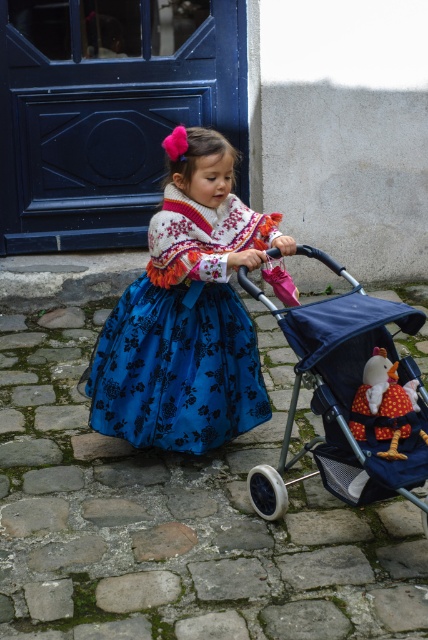
Is the position of matte blue stroller at center less distant than that of velvet plush doll at center?

Yes, it is.

Who is more distant from viewer, (410, 493) or (392, 451)?

The point (392, 451) is behind.

At what (x,y) coordinates should I click in order to perform the action: click on matte blue stroller at center. Please return your answer as a coordinate pair (x, y). Image resolution: width=428 pixels, height=640 pixels. Looking at the image, I should click on (332, 387).

Is blue satin dress at center to the left of velvet plush doll at center from the viewer's perspective?

Yes, blue satin dress at center is to the left of velvet plush doll at center.

Between point (204, 225) and point (374, 420), which one is positioned in front?

Point (374, 420)

Measure the distance between point [255,227] and camera.

Point [255,227] is 11.27 feet away from camera.

Where is `blue satin dress at center`? This screenshot has width=428, height=640. blue satin dress at center is located at coordinates point(183,333).

Is blue satin dress at center smaller than matte blue stroller at center?

Yes.

Who is positioned more to the left, blue satin dress at center or matte blue stroller at center?

Positioned to the left is blue satin dress at center.

Where is `blue satin dress at center`? The width and height of the screenshot is (428, 640). blue satin dress at center is located at coordinates click(183, 333).

This screenshot has width=428, height=640. Find the location of `blue satin dress at center`. blue satin dress at center is located at coordinates (183, 333).